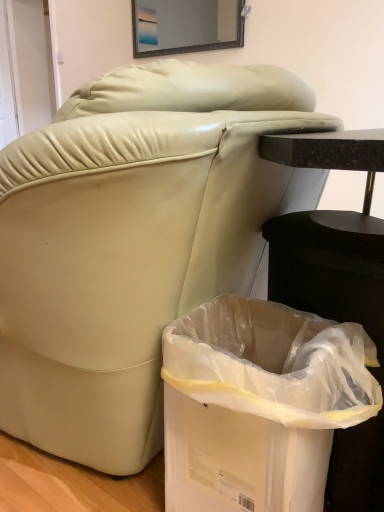
Question: From a real-world perspective, is white plastic trash bin at lower right on matte glass mirror at upper center?

Choices:
 (A) no
 (B) yes

Answer: (A)

Question: Is white plastic trash bin at lower right facing away from matte glass mirror at upper center?

Choices:
 (A) no
 (B) yes

Answer: (A)

Question: Is white plastic trash bin at lower right thinner than matte glass mirror at upper center?

Choices:
 (A) yes
 (B) no

Answer: (B)

Question: Is white plastic trash bin at lower right not near matte glass mirror at upper center?

Choices:
 (A) yes
 (B) no

Answer: (A)

Question: Is white plastic trash bin at lower right shorter than matte glass mirror at upper center?

Choices:
 (A) yes
 (B) no

Answer: (B)

Question: Does white plastic trash bin at lower right appear on the right side of matte glass mirror at upper center?

Choices:
 (A) no
 (B) yes

Answer: (B)

Question: From the image's perspective, is matte glass mirror at upper center located beneath white plastic trash bin at lower right?

Choices:
 (A) yes
 (B) no

Answer: (B)

Question: Is matte glass mirror at upper center taller than white plastic trash bin at lower right?

Choices:
 (A) no
 (B) yes

Answer: (A)

Question: From a real-world perspective, is matte glass mirror at upper center beneath white plastic trash bin at lower right?

Choices:
 (A) yes
 (B) no

Answer: (B)

Question: Does matte glass mirror at upper center have a lesser height compared to white plastic trash bin at lower right?

Choices:
 (A) yes
 (B) no

Answer: (A)

Question: Considering the relative positions of matte glass mirror at upper center and white plastic trash bin at lower right in the image provided, is matte glass mirror at upper center to the right of white plastic trash bin at lower right from the viewer's perspective?

Choices:
 (A) no
 (B) yes

Answer: (A)

Question: Does matte glass mirror at upper center touch white plastic trash bin at lower right?

Choices:
 (A) yes
 (B) no

Answer: (B)

Question: In the image, is matte glass mirror at upper center on the left side or the right side of white plastic trash bin at lower right?

Choices:
 (A) left
 (B) right

Answer: (A)